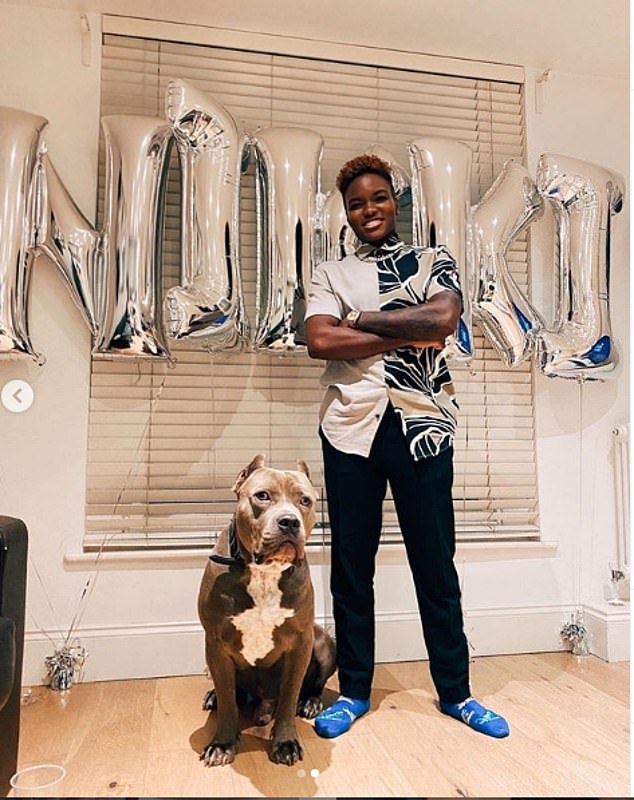
Locate an element on the screen. wall is located at coordinates (383, 62).